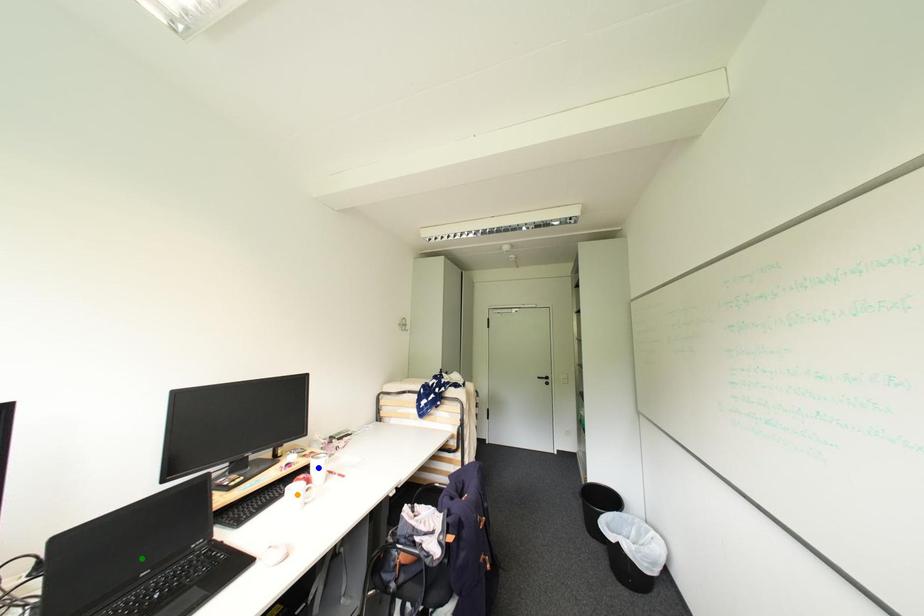
Order these from nearest to farthest:
A) blue point
B) green point
C) orange point

green point < orange point < blue point